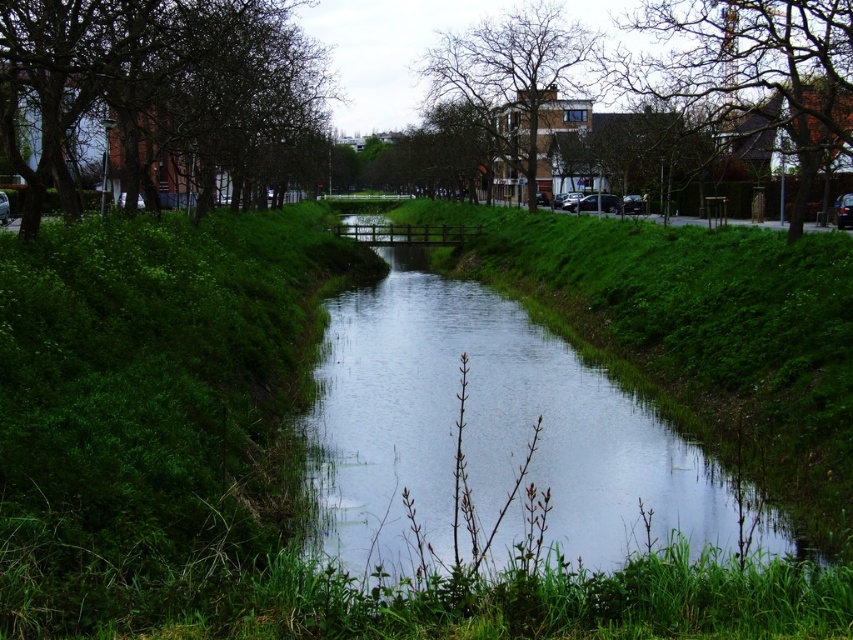
Consider the image. You are standing at the point marked by the coordinates point (157, 77) in the canal scene. What object are you directly facing?

The point (157, 77) marks a dark brown textured tree at left, so you are directly facing the dark brown textured tree at left.